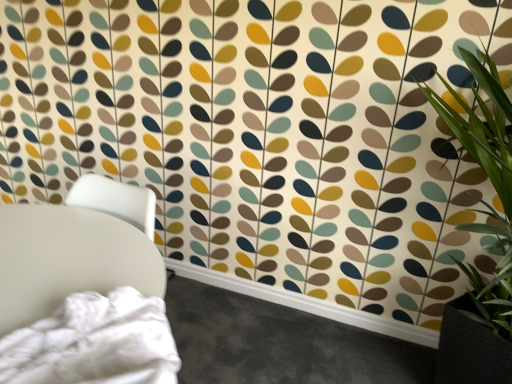
Question: Is white matte chair at left next to green leafy plant at right and touching it?

Choices:
 (A) no
 (B) yes

Answer: (A)

Question: Is white matte chair at left closer to camera compared to green leafy plant at right?

Choices:
 (A) yes
 (B) no

Answer: (B)

Question: From the image's perspective, would you say white matte chair at left is shown under green leafy plant at right?

Choices:
 (A) yes
 (B) no

Answer: (A)

Question: From a real-world perspective, is white matte chair at left on top of green leafy plant at right?

Choices:
 (A) no
 (B) yes

Answer: (A)

Question: From the image's perspective, would you say white matte chair at left is positioned over green leafy plant at right?

Choices:
 (A) yes
 (B) no

Answer: (B)

Question: Considering the relative sizes of white matte chair at left and green leafy plant at right in the image provided, is white matte chair at left thinner than green leafy plant at right?

Choices:
 (A) no
 (B) yes

Answer: (B)

Question: Is green leafy plant at right to the right of white matte chair at left from the viewer's perspective?

Choices:
 (A) yes
 (B) no

Answer: (A)

Question: Is green leafy plant at right to the left of white matte chair at left from the viewer's perspective?

Choices:
 (A) no
 (B) yes

Answer: (A)

Question: Is green leafy plant at right not inside white matte chair at left?

Choices:
 (A) yes
 (B) no

Answer: (A)

Question: Is white matte chair at left located within green leafy plant at right?

Choices:
 (A) yes
 (B) no

Answer: (B)

Question: Considering the relative sizes of green leafy plant at right and white matte chair at left in the image provided, is green leafy plant at right bigger than white matte chair at left?

Choices:
 (A) no
 (B) yes

Answer: (B)

Question: Would you consider green leafy plant at right to be distant from white matte chair at left?

Choices:
 (A) no
 (B) yes

Answer: (B)

Question: Considering the relative positions of white matte chair at left and green leafy plant at right in the image provided, is white matte chair at left to the left or to the right of green leafy plant at right?

Choices:
 (A) left
 (B) right

Answer: (A)